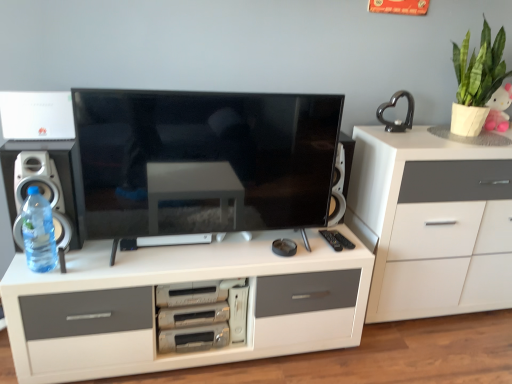
Question: Is point (397, 92) closer or farther from the camera than point (509, 99)?

Choices:
 (A) farther
 (B) closer

Answer: (A)

Question: From a real-world perspective, is black glossy heart at upper right above or below pink plush toy at upper right?

Choices:
 (A) above
 (B) below

Answer: (B)

Question: Which object is the closest to the white matte chest of drawers at center, arranged as the 2th chest of drawers when viewed from the top?

Choices:
 (A) pink plush toy at upper right
 (B) clear plastic bottle at left
 (C) black glossy heart at upper right
 (D) metallic silver stereo at center
 (E) black glossy tv at center

Answer: (D)

Question: Which is farther from the white matte cabinet at right, positioned as the second chest of drawers in bottom-to-top order?

Choices:
 (A) white plastic speaker at left
 (B) black glossy tv at center
 (C) black glossy heart at upper right
 (D) white matte chest of drawers at center, arranged as the 2th chest of drawers when viewed from the top
 (E) clear plastic bottle at left

Answer: (E)